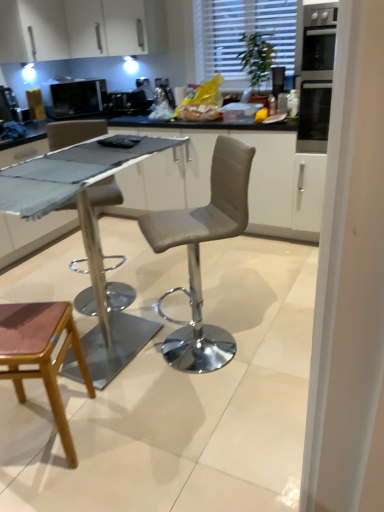
Where is `vacant area situated below pink leather stool at lower left (from a real-world perspective)`? The height and width of the screenshot is (512, 384). vacant area situated below pink leather stool at lower left (from a real-world perspective) is located at coordinates (43, 432).